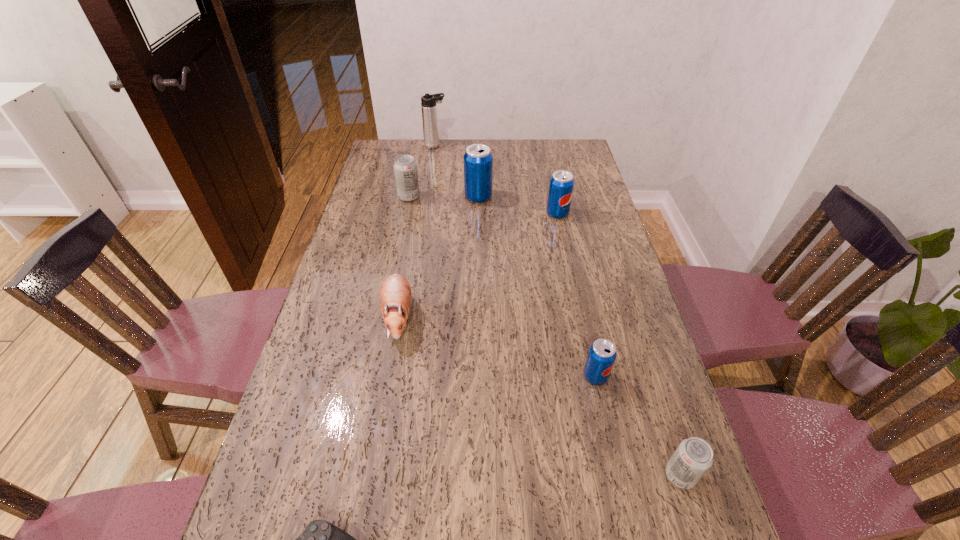
In order to click on object that is positioned at the far edge in this screenshot , I will do `click(428, 102)`.

At what (x,y) coordinates should I click in order to perform the action: click on object that is at the left edge. Please return your answer as a coordinate pair (x, y). The height and width of the screenshot is (540, 960). Looking at the image, I should click on (405, 167).

Where is `blank space at the far edge of the desktop`? blank space at the far edge of the desktop is located at coordinates (539, 141).

I want to click on free point at the left edge, so click(x=372, y=295).

Find the location of a particular element. vacant space at the right edge of the desktop is located at coordinates (626, 420).

Image resolution: width=960 pixels, height=540 pixels. What are the coordinates of `vacant area at the far right corner` in the screenshot? It's located at (572, 144).

You are a GUI agent. You are given a task and a screenshot of the screen. Output one action in this format:
    pyautogui.click(x=<x>, y=<y>)
    Task: Click on the free space between the third nearest soda can and the leftmost soda can
    The height and width of the screenshot is (540, 960).
    Given the screenshot: What is the action you would take?
    pyautogui.click(x=483, y=205)

Identify the location of unoccupied area between the second nearest blue pop soda and the left gray soda can. (483, 205).

Locate an element on the screen. The width and height of the screenshot is (960, 540). vacant area that lies between the second soda can from left to right and the farther gray soda can is located at coordinates (444, 197).

Identify the location of vacant space in between the fourth soda can from right to left and the bigger gray soda can. The height and width of the screenshot is (540, 960). (444, 197).